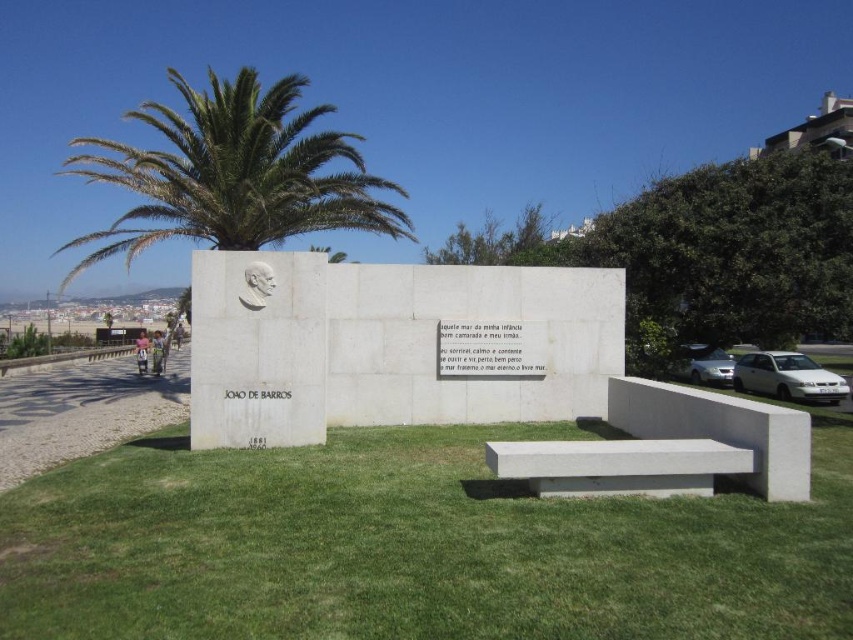
You are standing in front of the memorial and want to place a wreath on the green grass at center. Given that the coordinates of the grass are at point 0.856, 0.483, can you determine if the grass is positioned in the central area of the monument?

The green grass at center is located at point (410, 547), which is indeed in the central area of the monument as described.

You are sitting on the white concrete bench at center and want to move to the white concrete bench at lower center. Which direction should you move in relation to the monument?

The white concrete bench at lower center is behind the white concrete bench at center, so you should move backward away from the monument to reach it.

You are planning to sit on one of the benches in the memorial. The white concrete bench at center and the white concrete bench at lower center are both available. Which bench has a wider seating area?

The white concrete bench at center has a wider seating area than the white concrete bench at lower center because its width surpasses the other.